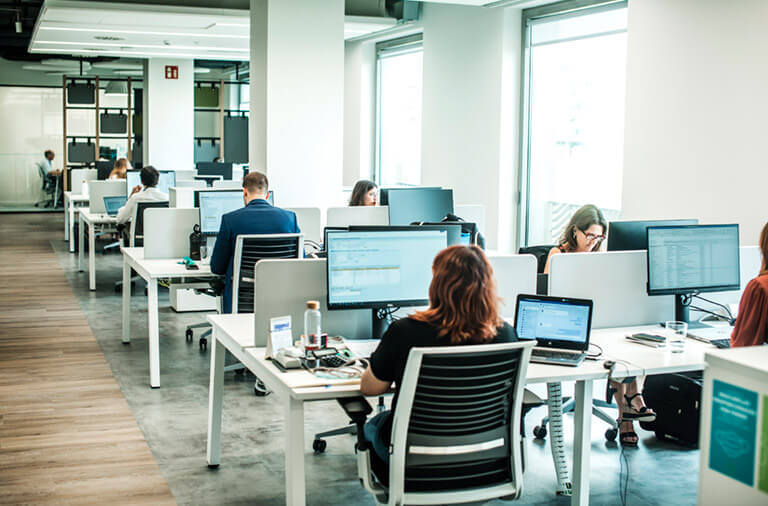
This screenshot has width=768, height=506. Find the location of `computer monitors`. computer monitors is located at coordinates (392, 256), (418, 210), (637, 227), (680, 261), (210, 198), (163, 181).